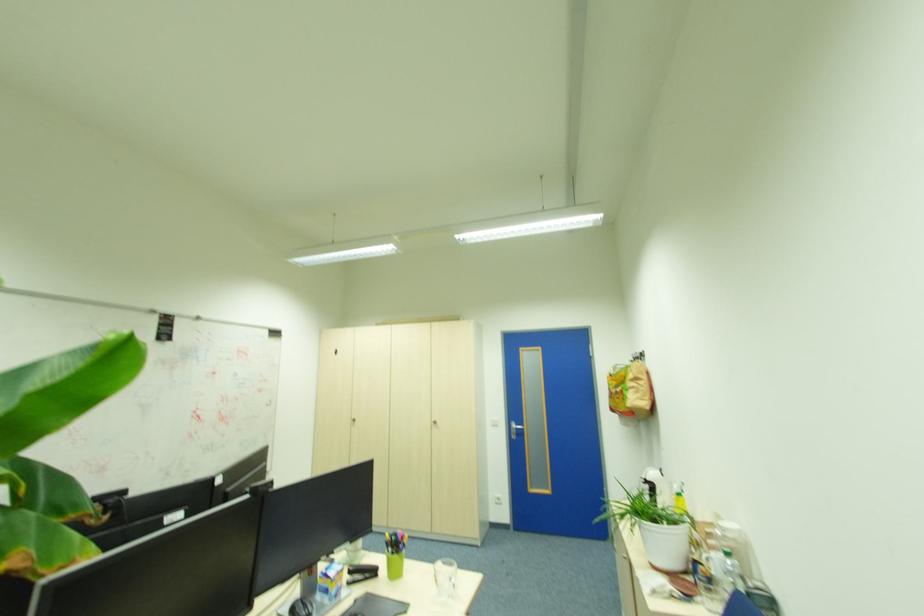
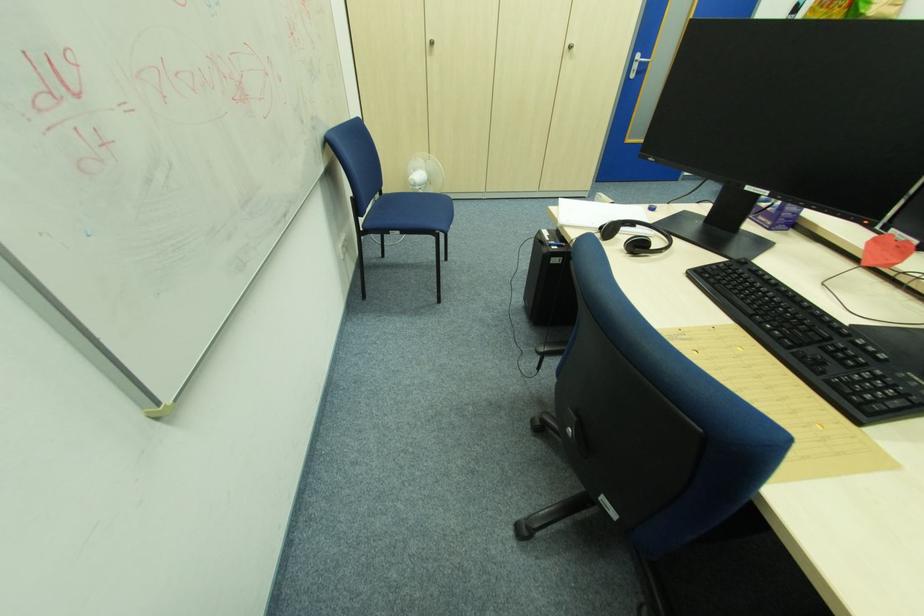
Locate, in the second image, the point that corresponds to pixel 520 427 in the first image.

(647, 61)